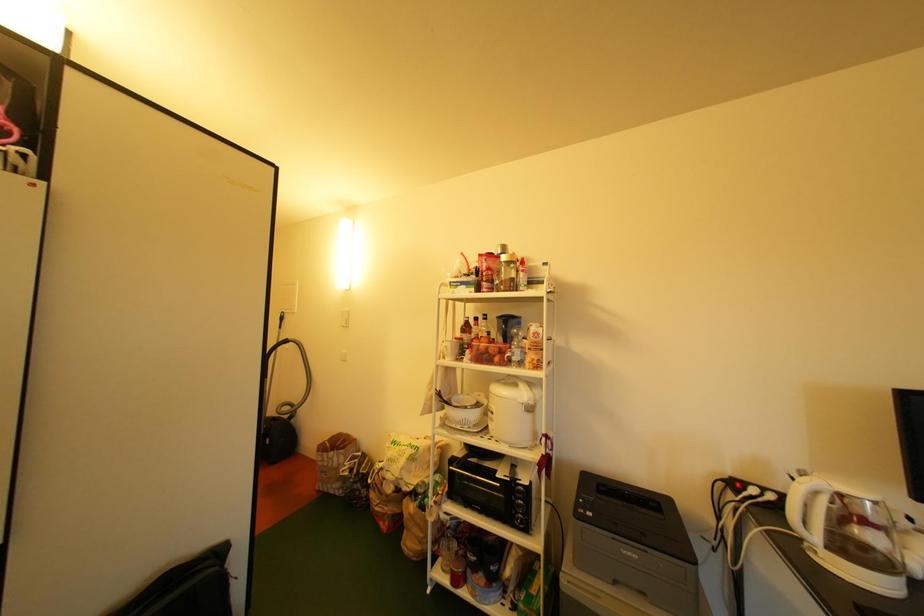
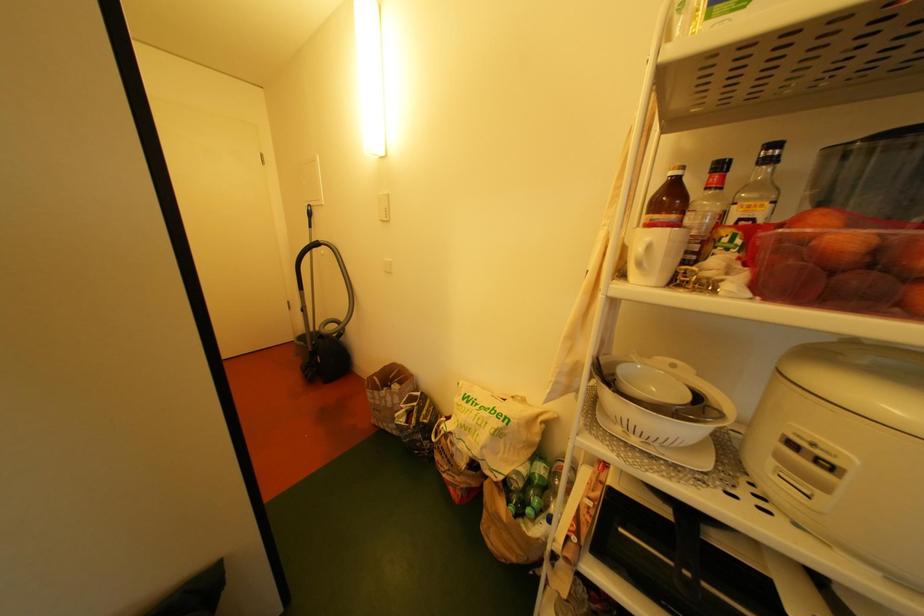
Which direction would the cameraman need to move to produce the second image?

The cameraman walked toward left, forward.